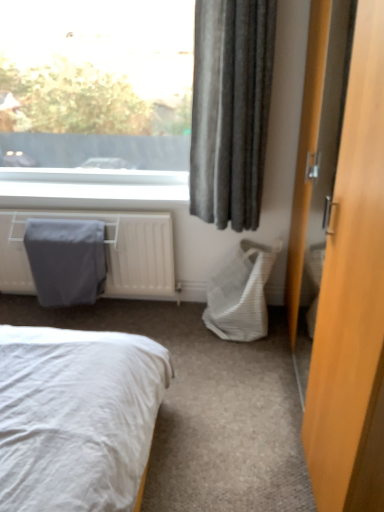
Question: Would you say white woven laundry basket at lower right is a long distance from dark grey fabric curtain at upper right?

Choices:
 (A) no
 (B) yes

Answer: (A)

Question: Considering the relative positions of white woven laundry basket at lower right and dark grey fabric curtain at upper right in the image provided, is white woven laundry basket at lower right in front of dark grey fabric curtain at upper right?

Choices:
 (A) yes
 (B) no

Answer: (B)

Question: From a real-world perspective, is white woven laundry basket at lower right on top of dark grey fabric curtain at upper right?

Choices:
 (A) no
 (B) yes

Answer: (A)

Question: Can you confirm if white woven laundry basket at lower right is bigger than dark grey fabric curtain at upper right?

Choices:
 (A) no
 (B) yes

Answer: (A)

Question: Is white woven laundry basket at lower right next to dark grey fabric curtain at upper right?

Choices:
 (A) yes
 (B) no

Answer: (B)

Question: Is white woven laundry basket at lower right facing away from dark grey fabric curtain at upper right?

Choices:
 (A) no
 (B) yes

Answer: (A)

Question: From the image's perspective, is gray fabric-covered radiator at left on white woven laundry basket at lower right?

Choices:
 (A) no
 (B) yes

Answer: (B)

Question: Can you confirm if gray fabric-covered radiator at left is taller than white woven laundry basket at lower right?

Choices:
 (A) yes
 (B) no

Answer: (B)

Question: From a real-world perspective, is gray fabric-covered radiator at left below white woven laundry basket at lower right?

Choices:
 (A) yes
 (B) no

Answer: (B)

Question: Is gray fabric-covered radiator at left next to white woven laundry basket at lower right and touching it?

Choices:
 (A) no
 (B) yes

Answer: (A)

Question: Considering the relative positions of gray fabric-covered radiator at left and white woven laundry basket at lower right in the image provided, is gray fabric-covered radiator at left to the left of white woven laundry basket at lower right from the viewer's perspective?

Choices:
 (A) yes
 (B) no

Answer: (A)

Question: Is gray fabric-covered radiator at left looking in the opposite direction of white woven laundry basket at lower right?

Choices:
 (A) no
 (B) yes

Answer: (A)

Question: Is dark grey fabric curtain at upper right looking in the opposite direction of gray fabric blanket at left?

Choices:
 (A) yes
 (B) no

Answer: (B)